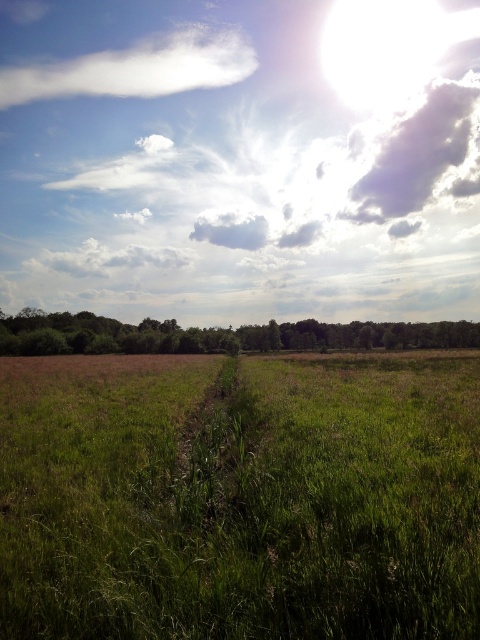
Question: Based on their relative distances, which object is farther from the white fluffy cloud at upper right?

Choices:
 (A) green leafy trees at center
 (B) white fluffy cloud at upper left
 (C) green grassy at center
 (D) bright white cloud at upper center

Answer: (C)

Question: Is green grassy at center above white fluffy cloud at upper left?

Choices:
 (A) yes
 (B) no

Answer: (B)

Question: Does bright white cloud at upper center have a larger size compared to green leafy trees at center?

Choices:
 (A) yes
 (B) no

Answer: (A)

Question: Estimate the real-world distances between objects in this image. Which object is farther from the green leafy trees at center?

Choices:
 (A) bright white cloud at upper center
 (B) gray fluffy cloud at upper center
 (C) green grassy at center

Answer: (C)

Question: Which of the following is the closest to the observer?

Choices:
 (A) (60, 397)
 (B) (440, 348)
 (C) (231, 236)

Answer: (A)

Question: Does green leafy trees at center appear on the right side of white fluffy cloud at upper left?

Choices:
 (A) yes
 (B) no

Answer: (A)